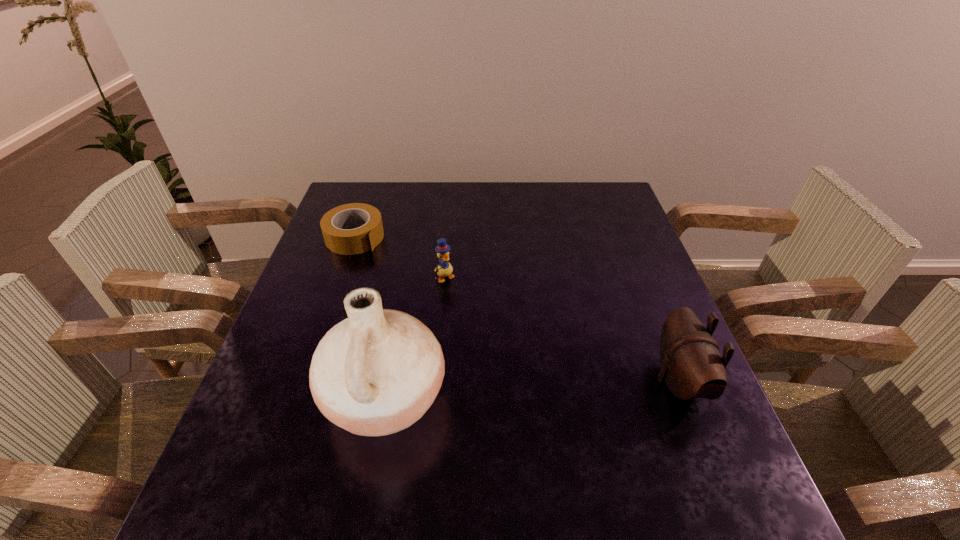
Where is `vacant space located 0.290m with the flap open on the rightmost object`? This screenshot has width=960, height=540. vacant space located 0.290m with the flap open on the rightmost object is located at coordinates (516, 381).

The height and width of the screenshot is (540, 960). Find the location of `free region located 0.070m with the flap open on the rightmost object`. free region located 0.070m with the flap open on the rightmost object is located at coordinates (622, 381).

Image resolution: width=960 pixels, height=540 pixels. Identify the location of free space located 0.110m with the flap open on the rightmost object. (603, 381).

Find the location of a particular element. The image size is (960, 540). vacant area situated on the face of the second farthest object, where the monocle is placed is located at coordinates (469, 307).

The image size is (960, 540). I want to click on free spot located 0.250m on the face of the second farthest object, where the monocle is placed, so click(504, 348).

Find the location of a particular element. vacant region located on the face of the second farthest object, where the monocle is placed is located at coordinates (469, 307).

You are a GUI agent. You are given a task and a screenshot of the screen. Output one action in this format:
    pyautogui.click(x=<x>, y=<y>)
    Task: Click on the vacant space situated 0.400m at the edge of the farthest object
    This screenshot has height=540, width=960.
    Given the screenshot: What is the action you would take?
    pyautogui.click(x=474, y=322)

Where is `free space located at the edge of the farthest object`? free space located at the edge of the farthest object is located at coordinates (383, 257).

You are a GUI agent. You are given a task and a screenshot of the screen. Output one action in this format:
    pyautogui.click(x=<x>, y=<y>)
    Task: Click on the vacant space located at the edge of the farthest object
    This screenshot has width=960, height=540.
    Given the screenshot: What is the action you would take?
    pyautogui.click(x=443, y=299)

Where is `object at the far edge`? object at the far edge is located at coordinates point(335,224).